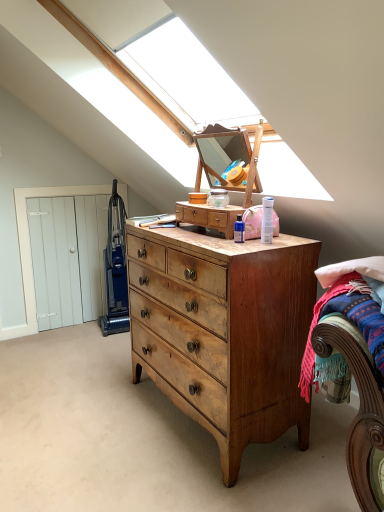
Where is `blue plastic vacuum cleaner at left`? This screenshot has width=384, height=512. blue plastic vacuum cleaner at left is located at coordinates (115, 269).

Describe the element at coordinates (354, 368) in the screenshot. I see `wooden bed at lower right` at that location.

Image resolution: width=384 pixels, height=512 pixels. What do you see at coordinates (224, 331) in the screenshot?
I see `light brown wood chest of drawers at center` at bounding box center [224, 331].

I want to click on blue plastic vacuum cleaner at left, so click(115, 269).

Considering the sizes of objects blue plastic vacuum cleaner at left and wooden bed at lower right in the image provided, who is wider, blue plastic vacuum cleaner at left or wooden bed at lower right?

blue plastic vacuum cleaner at left.

Consider the image. Between blue plastic vacuum cleaner at left and wooden bed at lower right, which one has smaller size?

With smaller size is wooden bed at lower right.

Are blue plastic vacuum cleaner at left and wooden bed at lower right far apart?

Indeed, blue plastic vacuum cleaner at left is not near wooden bed at lower right.

Looking at this image, from a real-world perspective, between wooden bed at lower right and light brown wood chest of drawers at center, who is vertically lower?

From a 3D spatial view, light brown wood chest of drawers at center is below.

Considering the positions of point (367, 366) and point (285, 248), is point (367, 366) closer or farther from the camera than point (285, 248)?

Clearly, point (367, 366) is closer to the camera than point (285, 248).

In the image, is wooden bed at lower right positioned in front of or behind blue plastic vacuum cleaner at left?

Visually, wooden bed at lower right is located in front of blue plastic vacuum cleaner at left.

Can you see wooden bed at lower right touching blue plastic vacuum cleaner at left?

No, wooden bed at lower right is not in contact with blue plastic vacuum cleaner at left.

Is point (380, 446) closer or farther from the camera than point (128, 316)?

Point (380, 446) is closer to the camera than point (128, 316).

Is wooden bed at lower right not within blue plastic vacuum cleaner at left?

That's correct, wooden bed at lower right is outside of blue plastic vacuum cleaner at left.

You are a GUI agent. You are given a task and a screenshot of the screen. Output one action in this format:
    pyautogui.click(x=<x>, y=<y>)
    Task: Click on the chest of drawers located in front of the light brown wood dresser at center
    Image resolution: width=384 pixels, height=512 pixels.
    Given the screenshot: What is the action you would take?
    (x=224, y=331)

From the picture: Considering the positions of objects light brown wood dresser at center and light brown wood chest of drawers at center in the image provided, who is more to the right, light brown wood dresser at center or light brown wood chest of drawers at center?

light brown wood dresser at center.

Does point (232, 219) appear closer or farther from the camera than point (247, 254)?

Clearly, point (232, 219) is more distant from the camera than point (247, 254).

Are wooden bed at lower right and light brown wood dresser at center located far from each other?

No.

Considering the relative sizes of wooden bed at lower right and light brown wood dresser at center in the image provided, is wooden bed at lower right thinner than light brown wood dresser at center?

No.

Considering the relative positions of wooden bed at lower right and light brown wood dresser at center in the image provided, is wooden bed at lower right in front of light brown wood dresser at center?

Yes, wooden bed at lower right is closer to the camera.

Consider the image. Is wooden bed at lower right surrounding light brown wood dresser at center?

No, light brown wood dresser at center is not surrounded by wooden bed at lower right.

Is blue plastic vacuum cleaner at left a part of light brown wood dresser at center?

No, blue plastic vacuum cleaner at left is not surrounded by light brown wood dresser at center.

Looking at this image, from the image's perspective, is light brown wood dresser at center on blue plastic vacuum cleaner at left?

Correct, light brown wood dresser at center appears higher than blue plastic vacuum cleaner at left in the image.

Can you tell me how much light brown wood dresser at center and blue plastic vacuum cleaner at left differ in facing direction?

They differ by 82.6 degrees in their facing directions.

Is light brown wood dresser at center to the left of blue plastic vacuum cleaner at left from the viewer's perspective?

No, light brown wood dresser at center is not to the left of blue plastic vacuum cleaner at left.

Relative to light brown wood dresser at center, is light brown wood chest of drawers at center in front or behind?

light brown wood chest of drawers at center is positioned closer to the viewer than light brown wood dresser at center.

Which object is thinner, light brown wood chest of drawers at center or light brown wood dresser at center?

With smaller width is light brown wood dresser at center.

What's the angular difference between light brown wood chest of drawers at center and light brown wood dresser at center's facing directions?

The angle between the facing direction of light brown wood chest of drawers at center and the facing direction of light brown wood dresser at center is 0.258 degrees.

Looking at this image, is light brown wood chest of drawers at center with light brown wood dresser at center?

No, light brown wood chest of drawers at center is not next to light brown wood dresser at center.

This screenshot has width=384, height=512. Identify the location of equipment located behind the wooden bed at lower right. (115, 269).

Locate an element on the screen. chest of drawers above the wooden bed at lower right (from the image's perspective) is located at coordinates (224, 331).

Looking at this image, from the image, which object appears to be farther from light brown wood dresser at center, light brown wood chest of drawers at center or wooden bed at lower right?

wooden bed at lower right is further to light brown wood dresser at center.

Which object lies further to the anchor point light brown wood dresser at center, blue plastic vacuum cleaner at left or wooden bed at lower right?

blue plastic vacuum cleaner at left is positioned further to the anchor light brown wood dresser at center.

Considering their positions, is light brown wood chest of drawers at center positioned further to blue plastic vacuum cleaner at left than wooden bed at lower right?

wooden bed at lower right is further to blue plastic vacuum cleaner at left.

Estimate the real-world distances between objects in this image. Which object is closer to light brown wood dresser at center, wooden bed at lower right or light brown wood chest of drawers at center?

light brown wood chest of drawers at center is closer to light brown wood dresser at center.

From the image, which object appears to be nearer to light brown wood chest of drawers at center, blue plastic vacuum cleaner at left or wooden bed at lower right?

wooden bed at lower right.

Looking at the image, which one is located further to blue plastic vacuum cleaner at left, light brown wood dresser at center or light brown wood chest of drawers at center?

Among the two, light brown wood dresser at center is located further to blue plastic vacuum cleaner at left.

From the image, which object appears to be farther from light brown wood chest of drawers at center, wooden bed at lower right or light brown wood dresser at center?

wooden bed at lower right is further to light brown wood chest of drawers at center.

Based on their spatial positions, is wooden bed at lower right or light brown wood chest of drawers at center further from blue plastic vacuum cleaner at left?

Based on the image, wooden bed at lower right appears to be further to blue plastic vacuum cleaner at left.

Where is `cabinetry located between light brown wood chest of drawers at center and blue plastic vacuum cleaner at left in the depth direction`? cabinetry located between light brown wood chest of drawers at center and blue plastic vacuum cleaner at left in the depth direction is located at coordinates (209, 216).

Locate an element on the screen. Image resolution: width=384 pixels, height=512 pixels. the chest of drawers positioned between wooden bed at lower right and light brown wood dresser at center from near to far is located at coordinates (224, 331).

I want to click on chest of drawers between wooden bed at lower right and blue plastic vacuum cleaner at left along the z-axis, so click(x=224, y=331).

Image resolution: width=384 pixels, height=512 pixels. What are the coordinates of `cabinetry between wooden bed at lower right and blue plastic vacuum cleaner at left along the z-axis` in the screenshot? It's located at (209, 216).